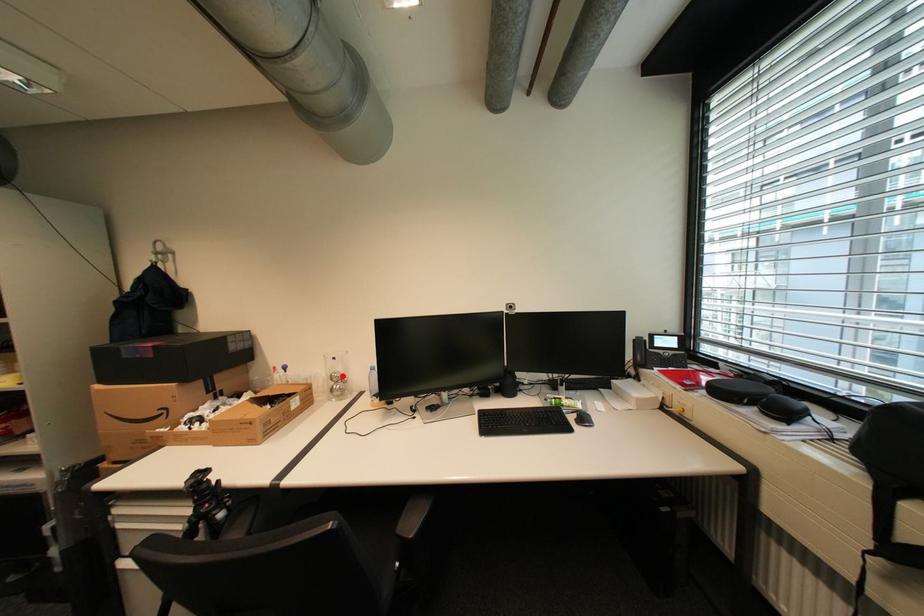
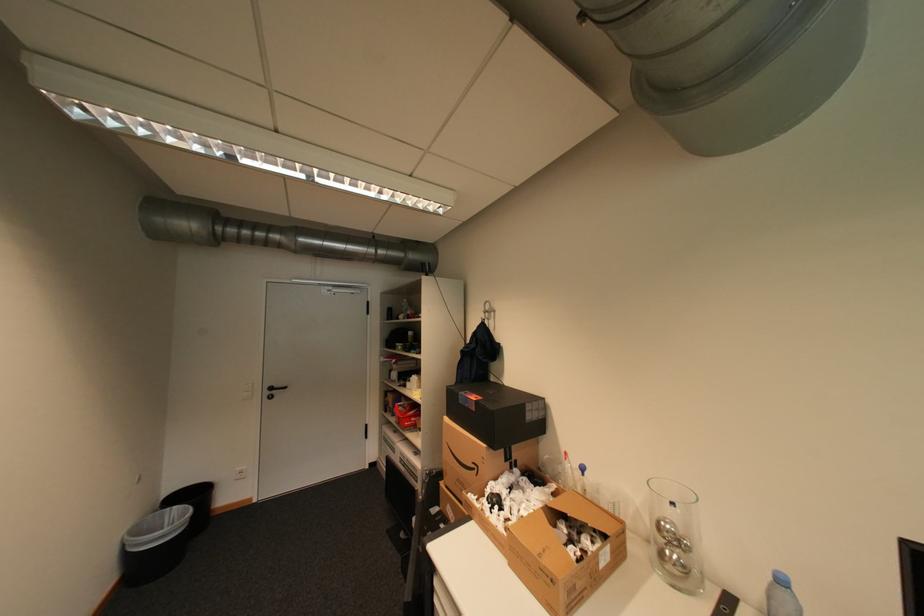
The point at the highlighted location is marked in the first image. Where is the corresponding point in the second image?

(673, 527)